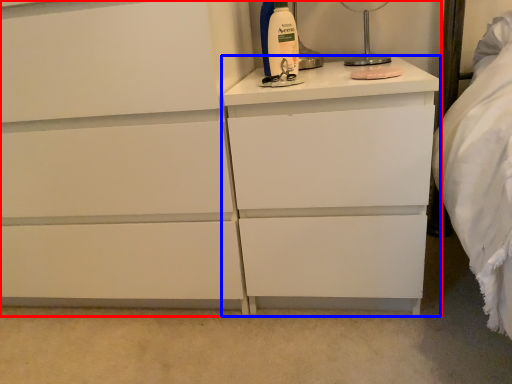
Question: Which point is further to the camera, chest of drawers (highlighted by a red box) or nightstand (highlighted by a blue box)?

Choices:
 (A) chest of drawers
 (B) nightstand

Answer: (B)